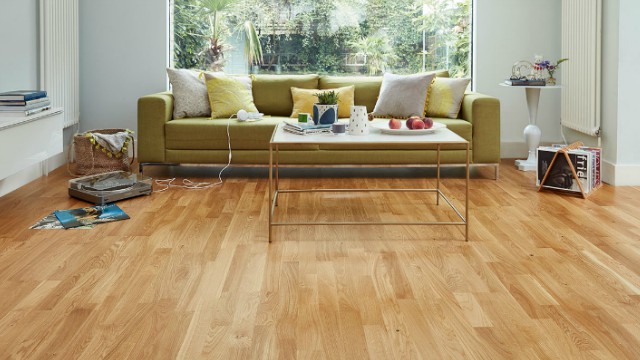
Where is `white pillows`? This screenshot has height=360, width=640. white pillows is located at coordinates (184, 99), (404, 96).